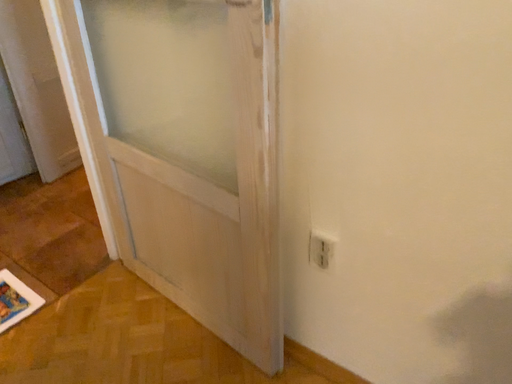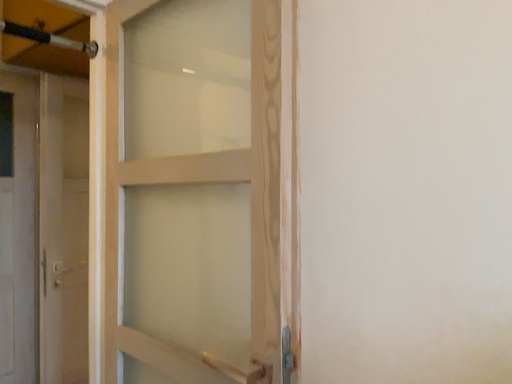
Question: Which way did the camera rotate in the video?

Choices:
 (A) rotated downward
 (B) rotated upward

Answer: (B)